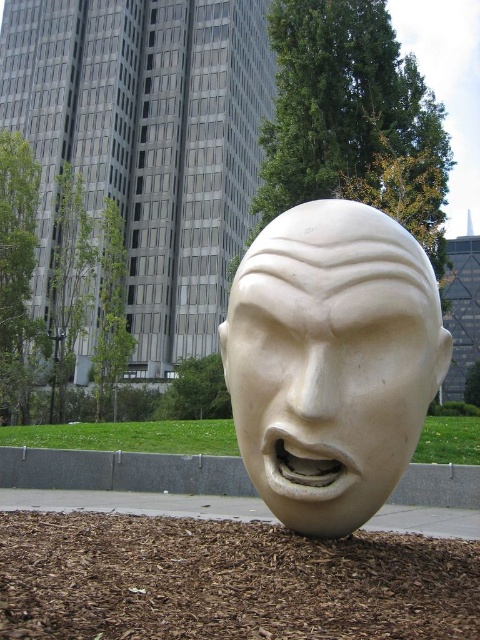
Can you confirm if white marble head at center is thinner than brown mulch at lower center?

Yes, white marble head at center is thinner than brown mulch at lower center.

You are a GUI agent. You are given a task and a screenshot of the screen. Output one action in this format:
    pyautogui.click(x=<x>, y=<y>)
    Task: Click on the white marble head at center
    The image size is (480, 640).
    Given the screenshot: What is the action you would take?
    pyautogui.click(x=331, y=362)

Is point (264, 499) positioned behind point (52, 609)?

Yes.

Identify the location of white marble head at center. (331, 362).